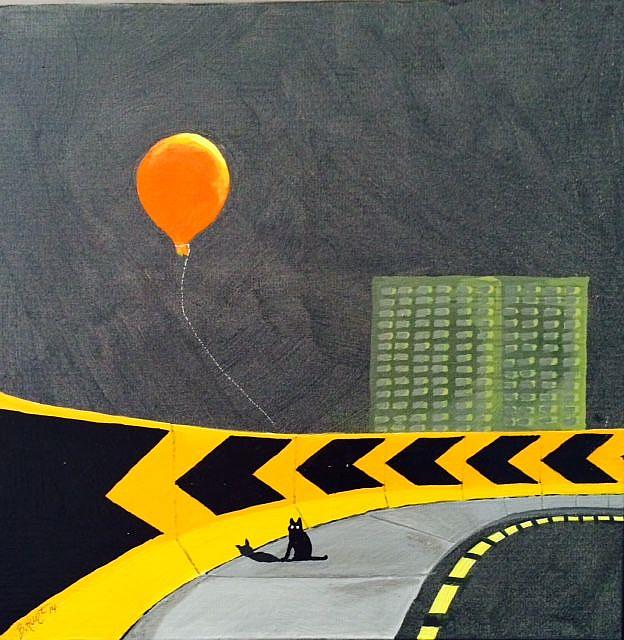
At what (x,y) coordinates should I click in order to perform the action: click on wall sections. Please return your answer as a coordinate pair (x, y). This screenshot has height=640, width=624. Looking at the image, I should click on (125, 592), (215, 548), (339, 514), (419, 496), (480, 496), (550, 488).